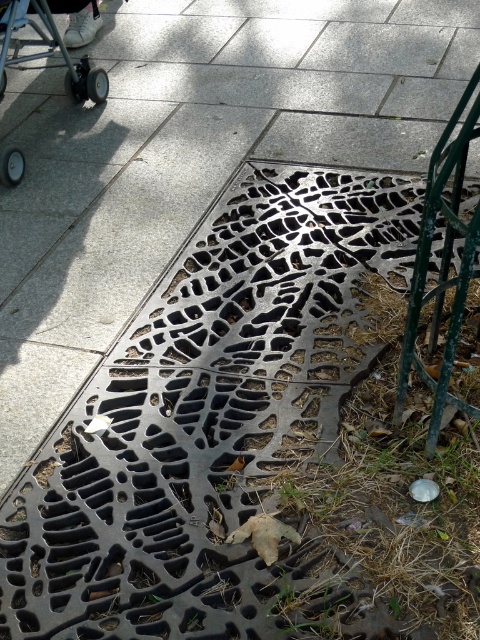
You are a delivery person pushing a cart with wheels. You see the green metal rail at right and the black rubber wheels at upper left. Which object is narrower?

The green metal rail at right is narrower than the black rubber wheels at upper left.

You are a delivery person trying to place a package on the ground between the green metal rail at right and the decorative metal grate. The package is 3 feet long. Can you fit it there?

The distance between the green metal rail at right and the decorative metal grate is 3.65 feet. Since the package is 3 feet long, it will fit with some space to spare.